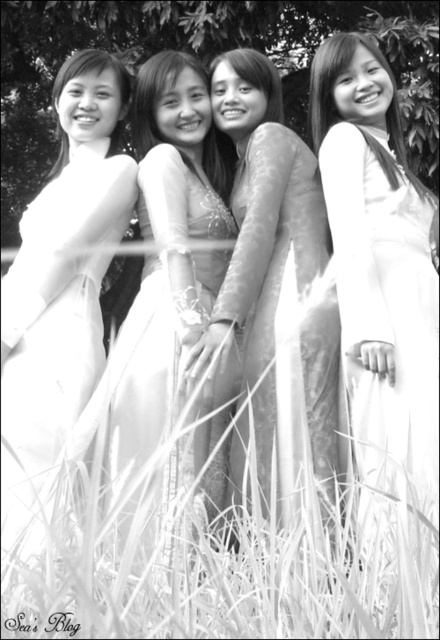
You are a photographer adjusting your camera to focus on two specific points in the image. The first point is labeled as point (x=409, y=337) and the second is point (x=80, y=586). Since you can only focus on one point at a time, which point should you choose to ensure the person closest to the camera is in focus?

Point (x=409, y=337) is further to the viewer than point (x=80, y=586), so focusing on point (x=409, y=337) will ensure the person closest to the camera is in focus.

You are a photographer trying to capture a clear shot of the white satin ao dai at center in this image. However, the white soft grass at center is blocking part of it. Can you determine which object takes up more space in the frame?

The white satin ao dai at center takes up more space in the frame than the white soft grass at center because the white soft grass at center occupies less space than the white satin ao dai at center.